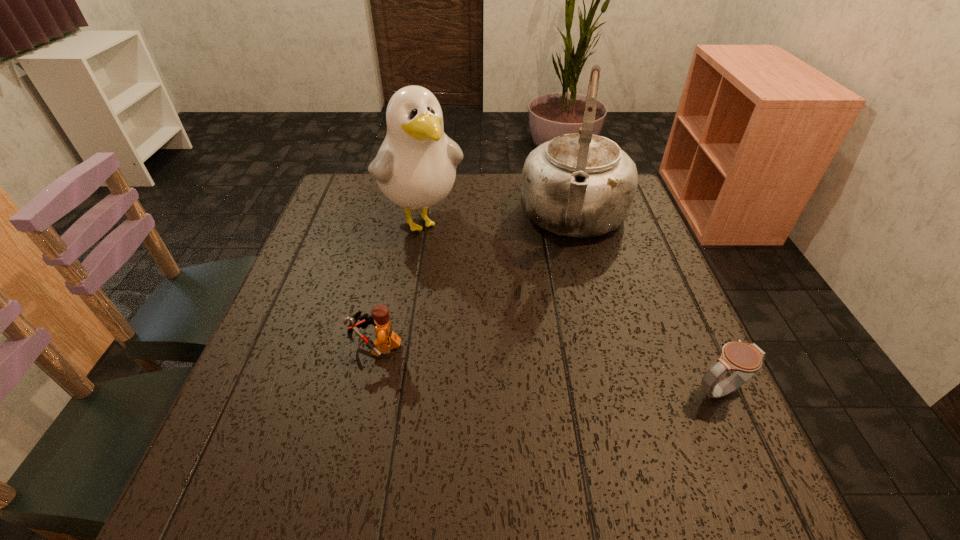
Find the location of a particular element. vacant space located 0.060m at the spout of the kettle is located at coordinates coord(570,278).

Locate an element on the screen. vacant space positioned 0.140m at the spout of the kettle is located at coordinates (567, 302).

The width and height of the screenshot is (960, 540). Find the location of `vacant space situated 0.390m at the spout of the kettle`. vacant space situated 0.390m at the spout of the kettle is located at coordinates (555, 397).

Where is `gull that is at the far edge`? The width and height of the screenshot is (960, 540). gull that is at the far edge is located at coordinates 415,167.

Locate an element on the screen. Image resolution: width=960 pixels, height=540 pixels. kettle situated at the far edge is located at coordinates (580, 185).

This screenshot has width=960, height=540. I want to click on object that is at the near edge, so click(746, 359).

Where is `object that is positioned at the left edge`? This screenshot has width=960, height=540. object that is positioned at the left edge is located at coordinates (415, 167).

This screenshot has height=540, width=960. In order to click on watch that is at the right edge in this screenshot , I will do `click(746, 359)`.

Find the location of a particular element. Image resolution: width=960 pixels, height=540 pixels. kettle positioned at the right edge is located at coordinates (580, 185).

This screenshot has height=540, width=960. Find the location of `object located in the far left corner section of the desktop`. object located in the far left corner section of the desktop is located at coordinates (415, 167).